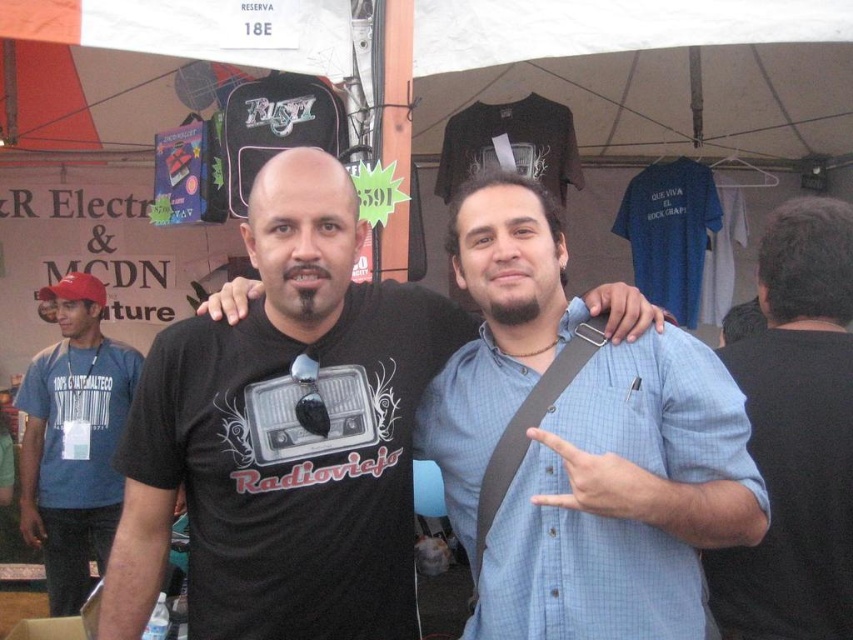
You are a GUI agent. You are given a task and a screenshot of the screen. Output one action in this format:
    pyautogui.click(x=<x>, y=<y>)
    Task: Click on the black matte t-shirt at center
    
    Given the screenshot: What is the action you would take?
    pyautogui.click(x=285, y=461)

Measure the distance between point [334,563] and camera.

1.69 meters

Who is more forward, (136, 637) or (779, 602)?

Positioned in front is point (136, 637).

Find the location of a particular element. This screenshot has width=853, height=640. black matte t-shirt at center is located at coordinates (285, 461).

Is dark gray shirt at right in front of blue cotton t-shirt at left?

Yes, dark gray shirt at right is in front of blue cotton t-shirt at left.

Which is below, dark gray shirt at right or blue cotton t-shirt at left?

blue cotton t-shirt at left

Which is behind, point (753, 580) or point (57, 458)?

The point (57, 458) is more distant.

This screenshot has height=640, width=853. Identify the location of dark gray shirt at right. pyautogui.click(x=796, y=435).

From the picture: Is light blue button-down shirt at center further to the viewer compared to dark gray shirt at right?

No, it is in front of dark gray shirt at right.

I want to click on light blue button-down shirt at center, so click(x=579, y=570).